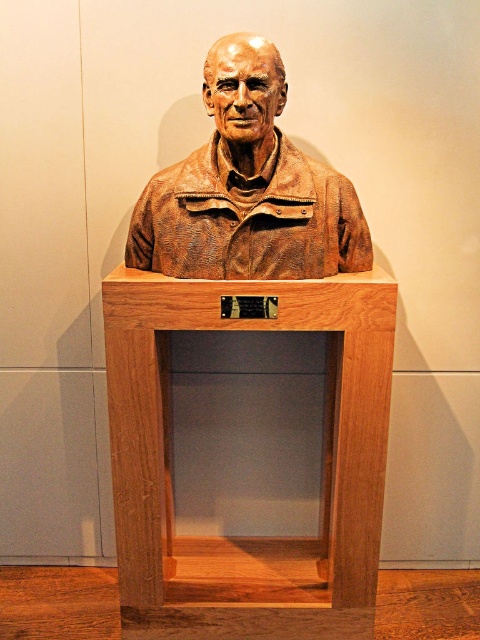
You are standing in front of the bust on the wooden pedestal. There are two points marked on the pedestal. Which point is closer to you, point (309, 314) or point (317, 225)?

Point (309, 314) is closer to the viewer than point (317, 225).